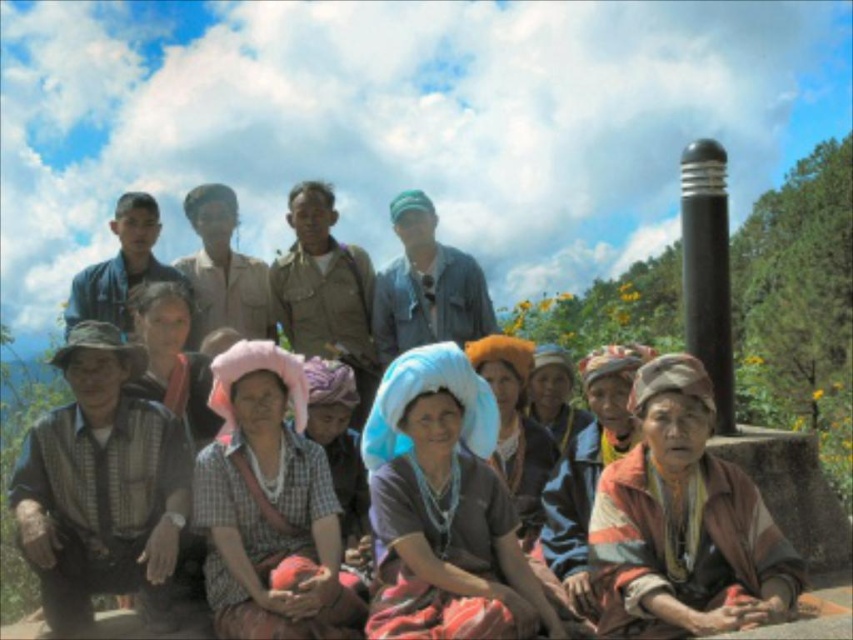
Question: Estimate the real-world distances between objects in this image. Which object is closer to the woven fabric shirt at lower left?

Choices:
 (A) multicolored fabric headscarf at lower right
 (B) matte blue headscarf at center
 (C) matte blue fabric headscarf at center

Answer: (B)

Question: Can you confirm if woven fabric shirt at lower left is positioned to the right of matte blue headscarf at center?

Choices:
 (A) yes
 (B) no

Answer: (B)

Question: Can you confirm if striped fabric headscarf at lower right is positioned above blue fabric headscarf at center?

Choices:
 (A) no
 (B) yes

Answer: (A)

Question: Which object is positioned closest to the woven fabric shirt at lower left?

Choices:
 (A) matte blue fabric headscarf at center
 (B) plaid fabric shirt at center

Answer: (B)

Question: Is multicolored fabric headscarf at lower right below woven fabric shirt at lower left?

Choices:
 (A) yes
 (B) no

Answer: (A)

Question: Considering the real-world distances, which object is farthest from the blue fabric headscarf at center?

Choices:
 (A) matte blue fabric headscarf at center
 (B) woven fabric shirt at lower left
 (C) plaid fabric shirt at center
 (D) striped fabric headscarf at lower right

Answer: (B)